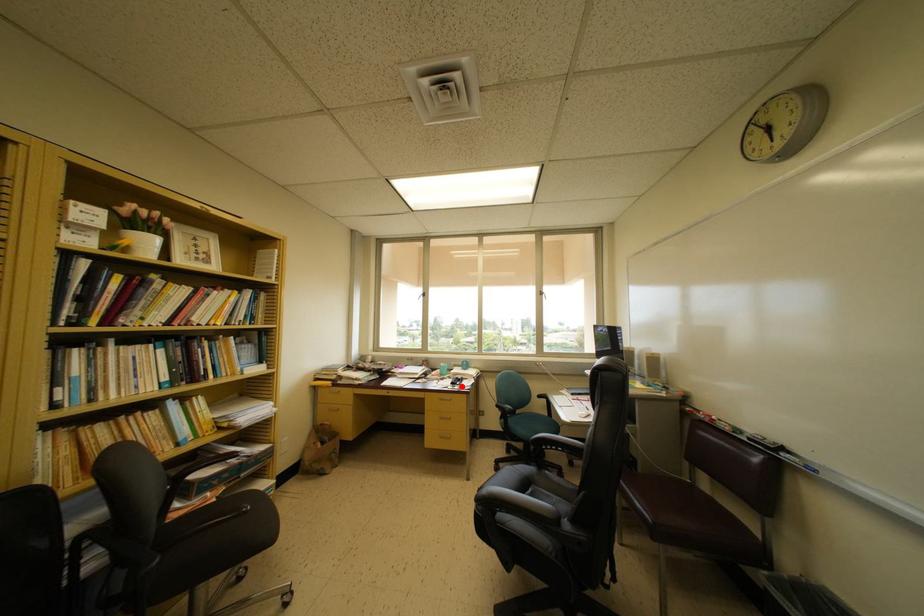
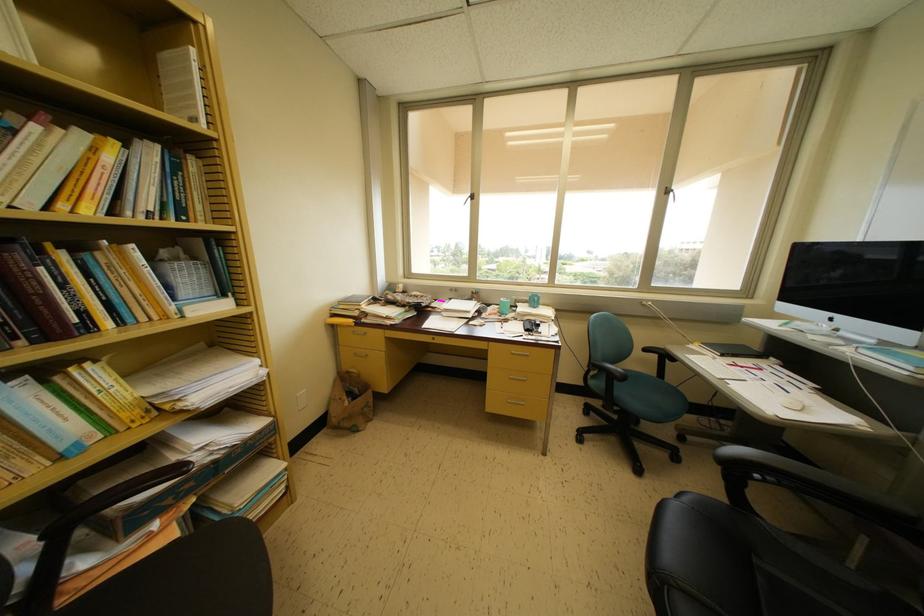
Question: I am providing you with two images of the same scene from different viewpoints. Image1 has a red point marked. In image2, the corresponding 3D location appears at what relative position? Reply with the corresponding letter.

Choices:
 (A) Closer
 (B) Farther

Answer: (A)